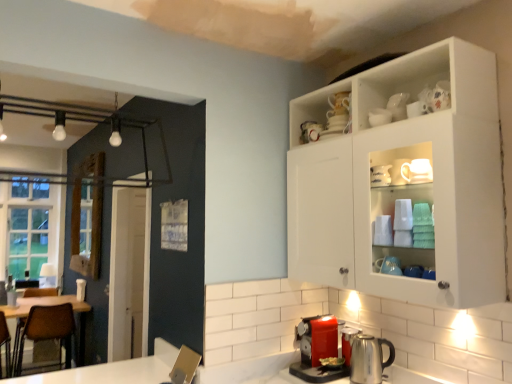
Question: Does white glossy cabinet at upper right appear on the left side of white ceramic mug at upper center, which ranks as the 2th tableware in back-to-front order?

Choices:
 (A) no
 (B) yes

Answer: (A)

Question: Is white glossy cabinet at upper right not close to white ceramic mug at upper center, the second tableware positioned from the top?

Choices:
 (A) yes
 (B) no

Answer: (B)

Question: Does white glossy cabinet at upper right have a lesser height compared to white ceramic mug at upper center, marked as the 1th tableware in a bottom-to-top arrangement?

Choices:
 (A) no
 (B) yes

Answer: (A)

Question: Is white glossy cabinet at upper right completely or partially outside of white ceramic mug at upper center, acting as the second tableware starting from the right?

Choices:
 (A) yes
 (B) no

Answer: (A)

Question: Can you confirm if white glossy cabinet at upper right is bigger than white ceramic mug at upper center, the second tableware positioned from the top?

Choices:
 (A) no
 (B) yes

Answer: (B)

Question: From the image's perspective, relative to white glossy mug at upper center, acting as the second tableware starting from the bottom, is metallic silver kettle at lower center above or below?

Choices:
 (A) below
 (B) above

Answer: (A)

Question: Is metallic silver kettle at lower center spatially inside white glossy mug at upper center, acting as the second tableware starting from the bottom, or outside of it?

Choices:
 (A) inside
 (B) outside

Answer: (B)

Question: Visually, is metallic silver kettle at lower center positioned to the left or to the right of white glossy mug at upper center, arranged as the 1th tableware when viewed from the top?

Choices:
 (A) left
 (B) right

Answer: (A)

Question: Is point (359, 374) positioned closer to the camera than point (392, 105)?

Choices:
 (A) farther
 (B) closer

Answer: (A)

Question: Considering the positions of point (380, 122) and point (54, 327), is point (380, 122) closer or farther from the camera than point (54, 327)?

Choices:
 (A) farther
 (B) closer

Answer: (B)

Question: From a real-world perspective, is white ceramic mug at upper center, marked as the 1th tableware in a bottom-to-top arrangement, positioned above or below brown leather chair at left?

Choices:
 (A) below
 (B) above

Answer: (B)

Question: Considering the positions of white ceramic mug at upper center, the 1th tableware when ordered from front to back, and brown leather chair at left in the image, is white ceramic mug at upper center, the 1th tableware when ordered from front to back, taller or shorter than brown leather chair at left?

Choices:
 (A) tall
 (B) short

Answer: (B)

Question: Considering the relative positions of white ceramic mug at upper center, marked as the 1th tableware in a bottom-to-top arrangement, and brown leather chair at left in the image provided, is white ceramic mug at upper center, marked as the 1th tableware in a bottom-to-top arrangement, to the left or to the right of brown leather chair at left?

Choices:
 (A) right
 (B) left

Answer: (A)

Question: Is white ceramic mug at upper center, acting as the second tableware starting from the right, bigger or smaller than white glossy mug at upper center, acting as the second tableware starting from the bottom?

Choices:
 (A) big
 (B) small

Answer: (A)

Question: Visually, is white ceramic mug at upper center, acting as the second tableware starting from the right, positioned to the left or to the right of white glossy mug at upper center, acting as the second tableware starting from the bottom?

Choices:
 (A) right
 (B) left

Answer: (B)